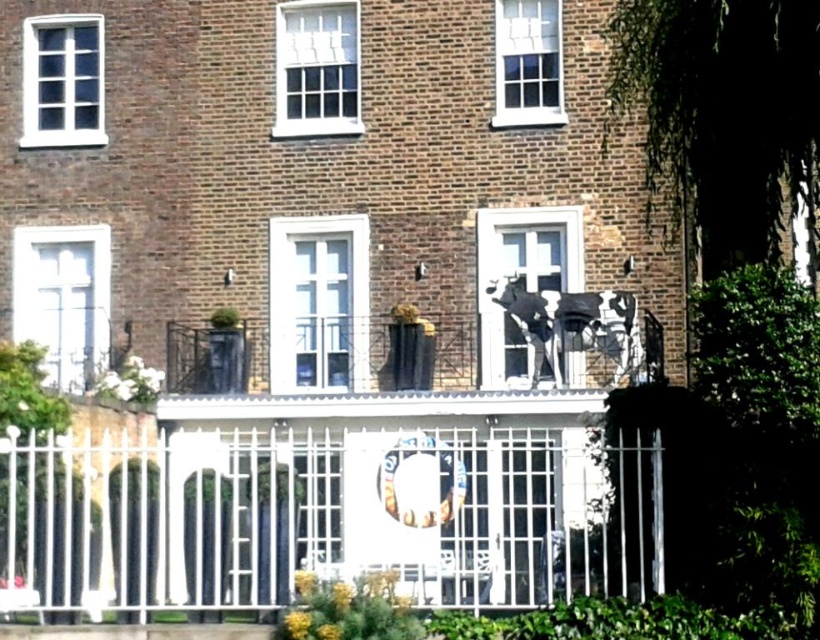
Who is taller, white glass window at center or metallic cow at center?

white glass window at center is taller.

Is white glass window at center wider than metallic cow at center?

Incorrect, white glass window at center's width does not surpass metallic cow at center's.

The image size is (820, 640). Describe the element at coordinates (317, 304) in the screenshot. I see `white glass window at center` at that location.

In order to click on white glass window at center in this screenshot , I will do `click(317, 304)`.

Is white glass cross at left to the right of white painted metal balcony at center from the viewer's perspective?

In fact, white glass cross at left is to the left of white painted metal balcony at center.

Who is shorter, white glass cross at left or white painted metal balcony at center?

white painted metal balcony at center is shorter.

Does point (30, 227) come behind point (208, 396)?

Yes, it is behind point (208, 396).

Find the location of a particular element. white glass cross at left is located at coordinates 62,300.

Can you confirm if white glass window at center is wider than white wooden window at upper center?

Yes, white glass window at center is wider than white wooden window at upper center.

Does white glass window at center appear over white wooden window at upper center?

Incorrect, white glass window at center is not positioned above white wooden window at upper center.

Where is `white glass window at center`? The image size is (820, 640). white glass window at center is located at coordinates (317, 304).

Locate an element on the screen. The width and height of the screenshot is (820, 640). white glass window at center is located at coordinates (317, 304).